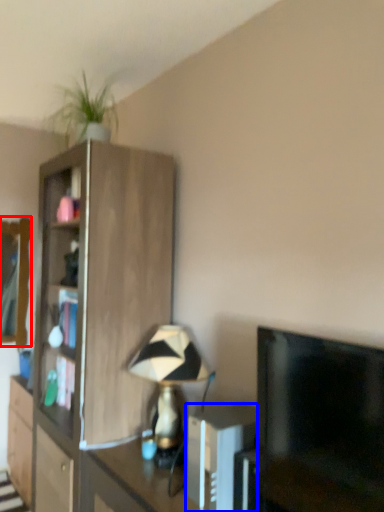
Question: Which of the following is the farthest to the observer, mirror (highlighted by a red box) or appliance (highlighted by a blue box)?

Choices:
 (A) mirror
 (B) appliance

Answer: (A)